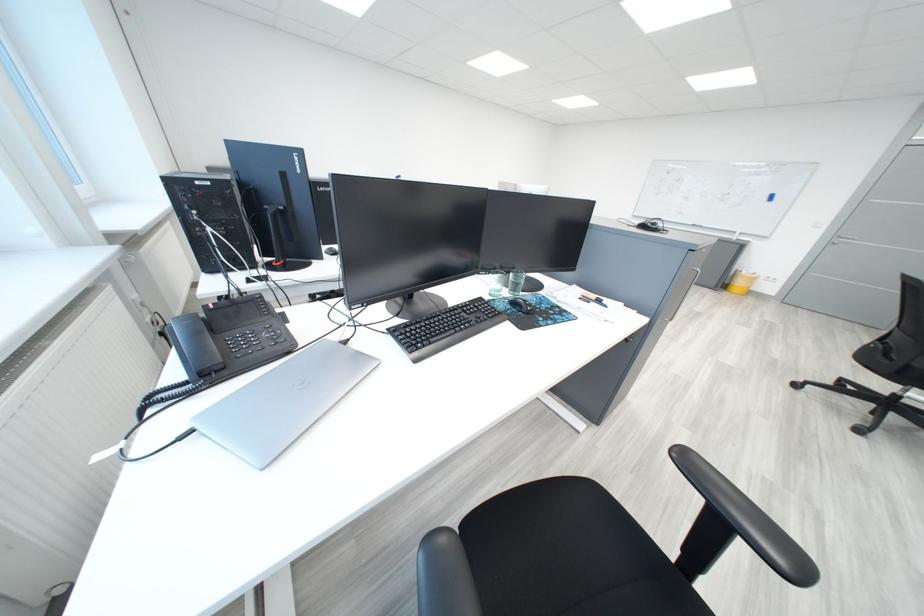
This screenshot has width=924, height=616. I want to click on gray cabinet handle, so 842,238.